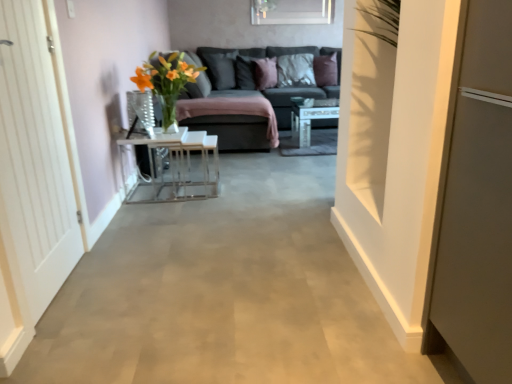
What are the coordinates of `vacant space underneath metallic white table at center (from a real-world perspective)` in the screenshot? It's located at (159, 190).